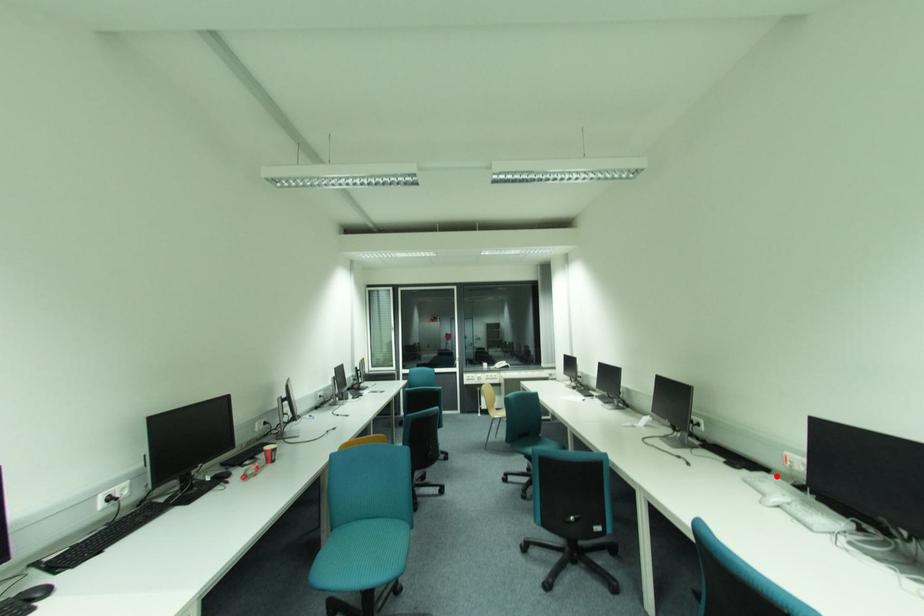
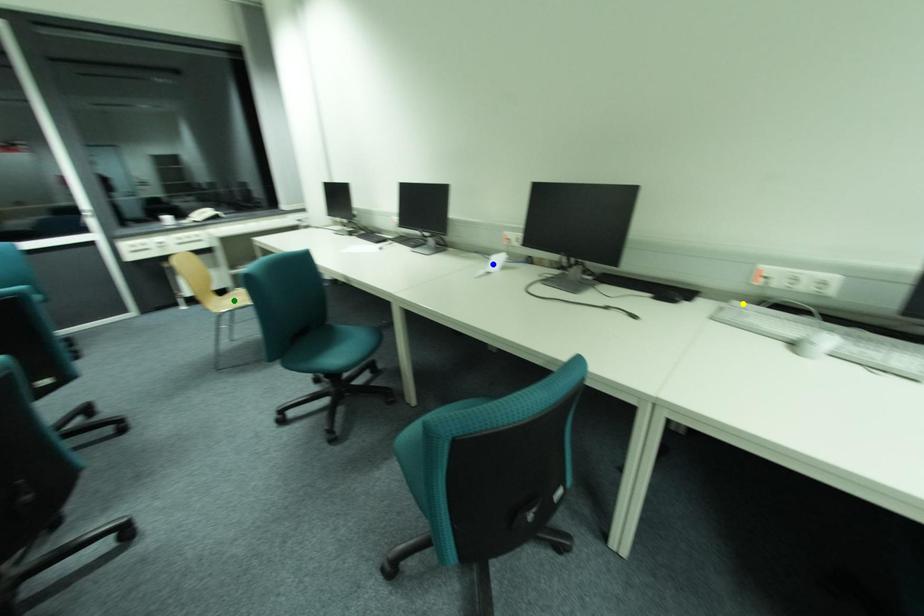
Question: I am providing you with two images of the same scene from different viewpoints. A red point is marked on the first image. You are given multiple points on the second image. Which point in image 2 is actually the same real-world point as the red point in image 1?

Choices:
 (A) green point
 (B) blue point
 (C) yellow point

Answer: (C)